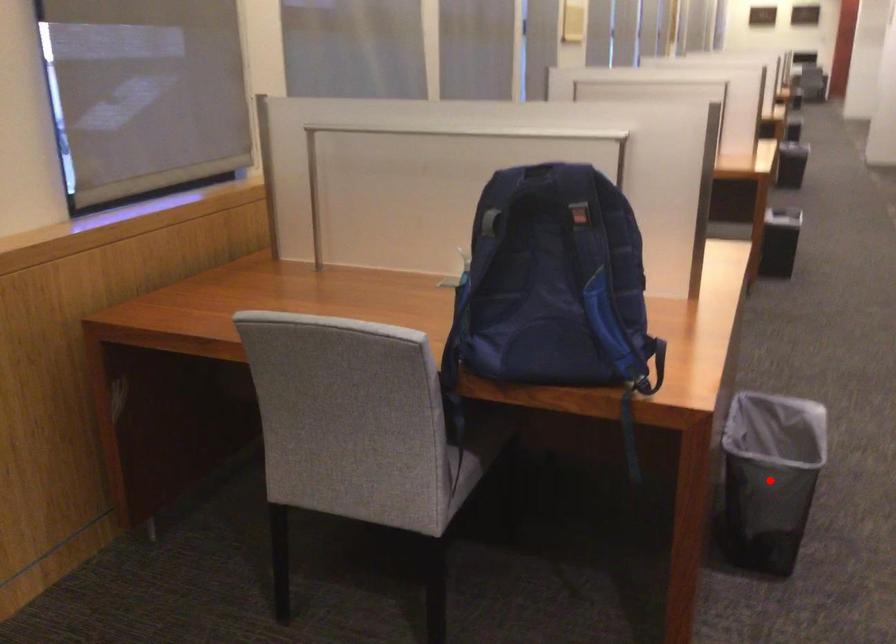
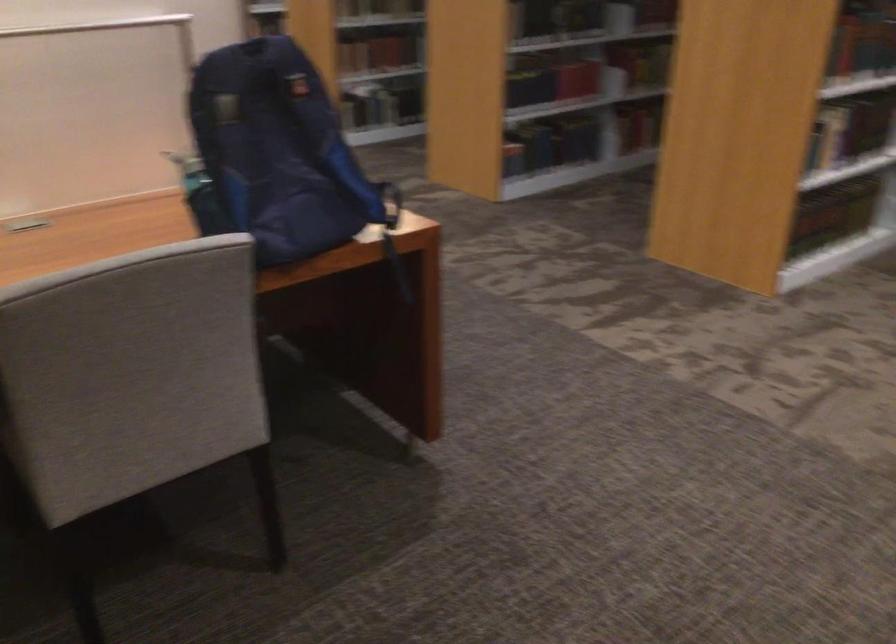
Question: I am providing you with two images of the same scene from different viewpoints. A red point is marked on the first image. At the location where the point appears in image 1, is it still visible in image 2?

Choices:
 (A) Yes
 (B) No

Answer: (B)